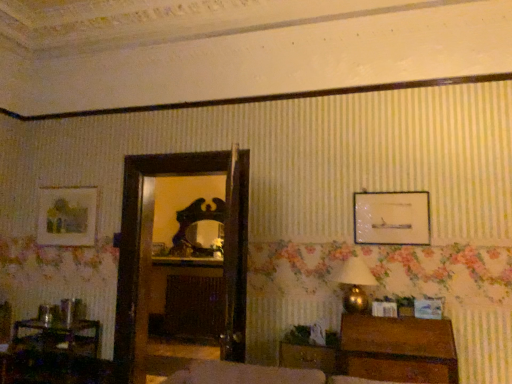
Identify the location of matte glass picture frame at upper right, which is the 1th picture frame from top to bottom. (391, 218).

From the picture: What is the approximate height of shiny dark wood mirror at center?

94.05 centimeters.

Describe the element at coordinates (397, 349) in the screenshot. I see `wooden chest at lower right` at that location.

This screenshot has height=384, width=512. Describe the element at coordinates (308, 357) in the screenshot. I see `wooden drawer at lower right` at that location.

The height and width of the screenshot is (384, 512). Find the location of `wooden table at lower left`. wooden table at lower left is located at coordinates (55, 355).

Measure the distance between point (55, 208) and camera.

They are 4.38 meters apart.

Where is `wooden picture frame at center, the 2th picture frame in the right-to-left sequence`? wooden picture frame at center, the 2th picture frame in the right-to-left sequence is located at coordinates (159, 249).

From a real-world perspective, which object stands above the other?

gold metallic table lamp at right.

Which object is more forward, gold metallic table lamp at right or wooden table at lower left?

gold metallic table lamp at right is in front.

Would you say gold metallic table lamp at right is inside or outside wooden table at lower left?

gold metallic table lamp at right is not enclosed by wooden table at lower left.

Looking at this image, looking at their sizes, would you say gold metallic table lamp at right is wider or thinner than wooden table at lower left?

In the image, gold metallic table lamp at right appears to be more narrow than wooden table at lower left.

Does wooden table at lower left have a larger size compared to shiny dark wood mirror at center?

Yes, wooden table at lower left is bigger than shiny dark wood mirror at center.

Based on the photo, is wooden table at lower left positioned beyond the bounds of shiny dark wood mirror at center?

Yes, wooden table at lower left is not within shiny dark wood mirror at center.

How distant is wooden table at lower left from shiny dark wood mirror at center?

wooden table at lower left is 1.84 meters away from shiny dark wood mirror at center.

Identify the location of table lying on the left of shiny dark wood mirror at center. This screenshot has height=384, width=512. (55, 355).

Does gold metallic table lamp at right turn towards matte wooden picture frame at upper left, which is the 2th picture frame in top-to-bottom order?

No, gold metallic table lamp at right is not turned towards matte wooden picture frame at upper left, which is the 2th picture frame in top-to-bottom order.

Is gold metallic table lamp at right beside matte wooden picture frame at upper left, which is counted as the first picture frame, starting from the left?

gold metallic table lamp at right and matte wooden picture frame at upper left, which is counted as the first picture frame, starting from the left, are clearly separated.

Does gold metallic table lamp at right come in front of matte wooden picture frame at upper left, which is counted as the second picture frame, starting from the bottom?

Yes.

From a real-world perspective, is gold metallic table lamp at right above or below matte wooden picture frame at upper left, positioned as the second picture frame in back-to-front order?

gold metallic table lamp at right is situated lower than matte wooden picture frame at upper left, positioned as the second picture frame in back-to-front order, in the real world.

Considering the sizes of objects wooden chest at lower right and wooden drawer at lower right in the image provided, who is thinner, wooden chest at lower right or wooden drawer at lower right?

Thinner between the two is wooden drawer at lower right.

Which is nearer, (431, 359) or (336, 354)?

Point (431, 359)

Can you confirm if wooden chest at lower right is shorter than wooden drawer at lower right?

Incorrect, the height of wooden chest at lower right does not fall short of that of wooden drawer at lower right.

Considering the relative sizes of gold metallic table lamp at right and wooden chest at lower right in the image provided, is gold metallic table lamp at right smaller than wooden chest at lower right?

Correct, gold metallic table lamp at right occupies less space than wooden chest at lower right.

Between gold metallic table lamp at right and wooden chest at lower right, which one has larger width?

With larger width is wooden chest at lower right.

From the picture: From the image's perspective, who appears lower, wooden picture frame at center, which is the 2th picture frame in left-to-right order, or matte glass picture frame at upper right, which is the 1th picture frame from top to bottom?

wooden picture frame at center, which is the 2th picture frame in left-to-right order, is shown below in the image.

What's the angular difference between wooden picture frame at center, which is the 2th picture frame in left-to-right order, and matte glass picture frame at upper right, which is the 1th picture frame from top to bottom,'s facing directions?

There is a 1.58-degree angle between the facing directions of wooden picture frame at center, which is the 2th picture frame in left-to-right order, and matte glass picture frame at upper right, which is the 1th picture frame from top to bottom.

Which of these two, wooden picture frame at center, positioned as the third picture frame in front-to-back order, or matte glass picture frame at upper right, the 3th picture frame in the left-to-right sequence, is thinner?

matte glass picture frame at upper right, the 3th picture frame in the left-to-right sequence, is thinner.

From a real-world perspective, is wooden picture frame at center, which appears as the 1th picture frame when ordered from the bottom, below matte glass picture frame at upper right, the 1th picture frame viewed from the front?

Yes.

From a real-world perspective, is matte wooden picture frame at upper left, which is the 3th picture frame from right to left, positioned above or below wooden table at lower left?

In terms of real-world spatial position, matte wooden picture frame at upper left, which is the 3th picture frame from right to left, is above wooden table at lower left.

Considering the sizes of objects matte wooden picture frame at upper left, which is the 3th picture frame from right to left, and wooden table at lower left in the image provided, who is bigger, matte wooden picture frame at upper left, which is the 3th picture frame from right to left, or wooden table at lower left?

wooden table at lower left is bigger.

Looking at this image, is matte wooden picture frame at upper left, which is counted as the second picture frame, starting from the bottom, to the left of wooden table at lower left from the viewer's perspective?

Indeed, matte wooden picture frame at upper left, which is counted as the second picture frame, starting from the bottom, is positioned on the left side of wooden table at lower left.

From the image's perspective, would you say matte wooden picture frame at upper left, which is the 2th picture frame from front to back, is shown under wooden table at lower left?

Incorrect, from the image's perspective, matte wooden picture frame at upper left, which is the 2th picture frame from front to back, is higher than wooden table at lower left.

What are the coordinates of `table lamp in front of the wooden table at lower left` in the screenshot? It's located at (355, 284).

Where is `table on the left side of shiny dark wood mirror at center`? This screenshot has width=512, height=384. table on the left side of shiny dark wood mirror at center is located at coordinates (55, 355).

Estimate the real-world distances between objects in this image. Which object is further from wooden drawer at lower right, shiny dark wood mirror at center or gold metallic table lamp at right?

The object further to wooden drawer at lower right is shiny dark wood mirror at center.

Based on their spatial positions, is wooden chest at lower right or matte wooden picture frame at upper left, which is the 2th picture frame from front to back, further from gold metallic table lamp at right?

Based on the image, matte wooden picture frame at upper left, which is the 2th picture frame from front to back, appears to be further to gold metallic table lamp at right.

When comparing their distances from wooden picture frame at center, arranged as the 1th picture frame when viewed from the back, does wooden table at lower left or wooden drawer at lower right seem closer?

wooden table at lower left.

Estimate the real-world distances between objects in this image. Which object is further from shiny dark wood mirror at center, matte glass picture frame at upper right, which is the 1th picture frame from top to bottom, or wooden picture frame at center, which appears as the 1th picture frame when ordered from the bottom?

matte glass picture frame at upper right, which is the 1th picture frame from top to bottom.

Estimate the real-world distances between objects in this image. Which object is further from wooden chest at lower right, gold metallic table lamp at right or shiny dark wood mirror at center?

shiny dark wood mirror at center is positioned further to the anchor wooden chest at lower right.

From the image, which object appears to be farther from matte glass picture frame at upper right, acting as the 3th picture frame starting from the back, gold metallic table lamp at right or wooden table at lower left?

Among the two, wooden table at lower left is located further to matte glass picture frame at upper right, acting as the 3th picture frame starting from the back.

Based on the photo, estimate the real-world distances between objects in this image. Which object is closer to wooden drawer at lower right, shiny dark wood mirror at center or wooden chest at lower right?

wooden chest at lower right is closer to wooden drawer at lower right.

Which object lies nearer to the anchor point wooden picture frame at center, arranged as the 1th picture frame when viewed from the back, matte glass picture frame at upper right, the 1th picture frame viewed from the front, or gold metallic table lamp at right?

Among the two, gold metallic table lamp at right is located nearer to wooden picture frame at center, arranged as the 1th picture frame when viewed from the back.

The image size is (512, 384). In order to click on picture frame positioned between wooden table at lower left and shiny dark wood mirror at center from near to far in this screenshot , I will do `click(67, 216)`.

The width and height of the screenshot is (512, 384). I want to click on table lamp between matte wooden picture frame at upper left, which is the 2th picture frame in top-to-bottom order, and matte glass picture frame at upper right, the 3th picture frame in the left-to-right sequence, so click(355, 284).

This screenshot has height=384, width=512. I want to click on mirror between gold metallic table lamp at right and wooden picture frame at center, which is the 2th picture frame in left-to-right order, from front to back, so click(195, 223).

This screenshot has height=384, width=512. I want to click on drawer between wooden table at lower left and wooden chest at lower right, so click(x=308, y=357).